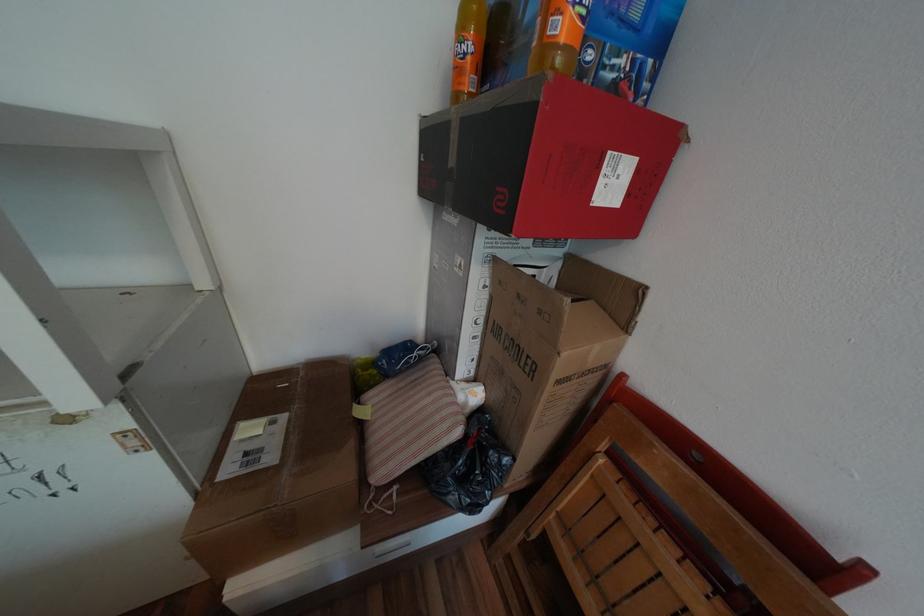
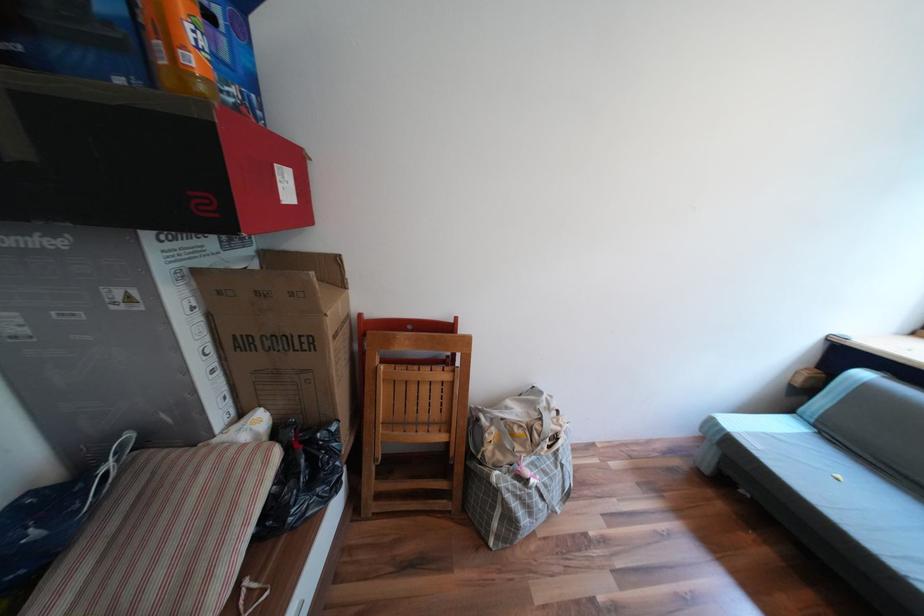
The point at (453, 419) is marked in the first image. Where is the corresponding point in the second image?

(258, 464)